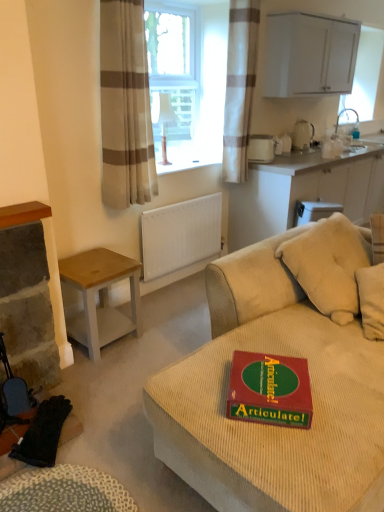
Question: Which direction should I rotate to look at white plastic container at upper center, placed as the first appliance when sorted from left to right, — up or down?

Choices:
 (A) up
 (B) down

Answer: (A)

Question: Is green cardboard game at center far away from white matte radiator at center?

Choices:
 (A) no
 (B) yes

Answer: (B)

Question: Is white matte radiator at center at the back of green cardboard game at center?

Choices:
 (A) no
 (B) yes

Answer: (B)

Question: Is the depth of green cardboard game at center greater than that of white matte radiator at center?

Choices:
 (A) no
 (B) yes

Answer: (A)

Question: From the image's perspective, is green cardboard game at center over white matte radiator at center?

Choices:
 (A) yes
 (B) no

Answer: (B)

Question: From a real-world perspective, is green cardboard game at center positioned under white matte radiator at center based on gravity?

Choices:
 (A) no
 (B) yes

Answer: (A)

Question: Can you confirm if green cardboard game at center is wider than white matte radiator at center?

Choices:
 (A) no
 (B) yes

Answer: (B)

Question: Considering the relative sizes of white glossy kettle at upper right, the 2th appliance when ordered from left to right, and beige striped curtain at upper right, arranged as the second curtain when viewed from the front, in the image provided, is white glossy kettle at upper right, the 2th appliance when ordered from left to right, shorter than beige striped curtain at upper right, arranged as the second curtain when viewed from the front,?

Choices:
 (A) yes
 (B) no

Answer: (A)

Question: Is white glossy kettle at upper right, the 2th appliance from the front, at the right side of beige striped curtain at upper right, the first curtain from the right?

Choices:
 (A) yes
 (B) no

Answer: (A)

Question: Does white glossy kettle at upper right, the 2th appliance from the front, appear on the left side of beige striped curtain at upper right, which appears as the 2th curtain when viewed from the left?

Choices:
 (A) no
 (B) yes

Answer: (A)

Question: Does white glossy kettle at upper right, the 2th appliance when ordered from left to right, contain beige striped curtain at upper right, the first curtain from the right?

Choices:
 (A) yes
 (B) no

Answer: (B)

Question: Does white glossy kettle at upper right, acting as the first appliance starting from the back, touch beige striped curtain at upper right, arranged as the 1th curtain when viewed from the back?

Choices:
 (A) no
 (B) yes

Answer: (A)

Question: Is the position of white glossy kettle at upper right, acting as the first appliance starting from the back, more distant than that of beige striped curtain at upper right, arranged as the 1th curtain when viewed from the back?

Choices:
 (A) no
 (B) yes

Answer: (B)

Question: From a real-world perspective, is silver metallic faucet at upper right below white glossy cabinet at upper right, which is the second cabinetry from bottom to top?

Choices:
 (A) no
 (B) yes

Answer: (B)